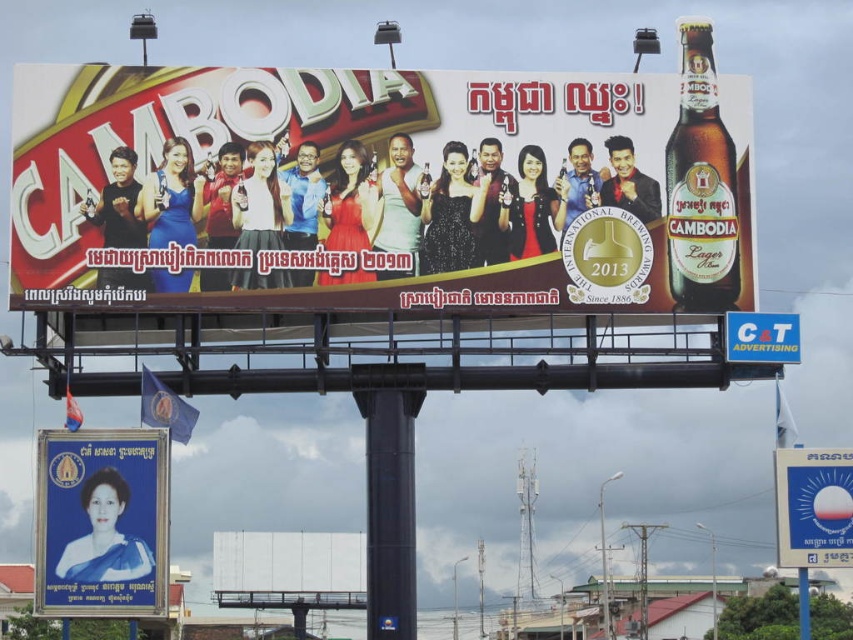
You are a graphic designer reviewing the billboard layout for Cambodia Lager. You need to ensure the blue fabric portrait at lower left and the white plastic sign at upper center are arranged correctly. According to the design guidelines, all textual elements must be placed above the main visual elements. Does the current arrangement comply with this rule?

The blue fabric portrait at lower left is below the white plastic sign at upper center. Since the white plastic sign at upper center is above, it meets the requirement as textual elements should be placed above main visuals.